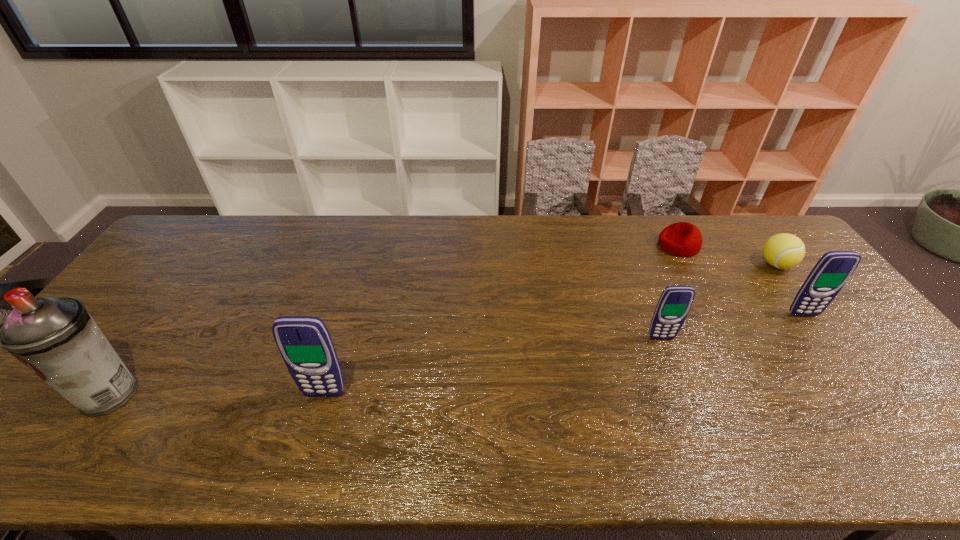
The image size is (960, 540). I want to click on aerosol can, so click(x=55, y=337).

Where is `free spot located on the front-facing side of the nearest cellular telephone`? free spot located on the front-facing side of the nearest cellular telephone is located at coordinates (317, 421).

Image resolution: width=960 pixels, height=540 pixels. In order to click on blank area located on the front-facing side of the shortest cellular telephone in this screenshot , I will do `click(681, 388)`.

I want to click on free space located 0.140m on the front-facing side of the fourth nearest object, so click(x=834, y=357).

Identify the location of free space located 0.080m on the seat area of the third object from right to left. (635, 246).

This screenshot has height=540, width=960. Find the location of `free space located 0.120m on the seat area of the third object from right to left`. free space located 0.120m on the seat area of the third object from right to left is located at coordinates (623, 246).

This screenshot has height=540, width=960. What are the coordinates of `vacant region located 0.100m on the seat area of the third object from right to left` in the screenshot? It's located at (629, 246).

This screenshot has height=540, width=960. Find the location of `free space located 0.400m on the front of the second shortest object`. free space located 0.400m on the front of the second shortest object is located at coordinates (867, 384).

Where is `vacant space situated 0.130m on the back of the aerosol can`? The height and width of the screenshot is (540, 960). vacant space situated 0.130m on the back of the aerosol can is located at coordinates [x=156, y=330].

Where is `beanbag that is at the far edge`? The height and width of the screenshot is (540, 960). beanbag that is at the far edge is located at coordinates (682, 239).